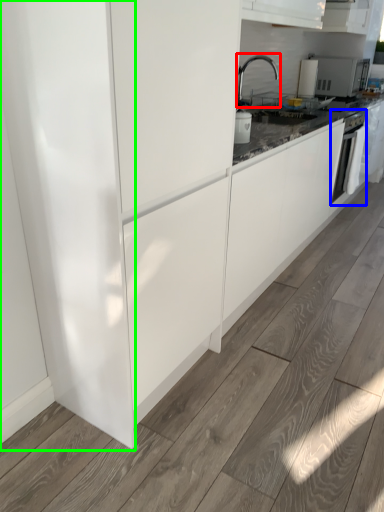
Question: Which is nearer to the tap (highlighted by a red box)? home appliance (highlighted by a blue box) or glass door (highlighted by a green box).

Choices:
 (A) home appliance
 (B) glass door

Answer: (A)